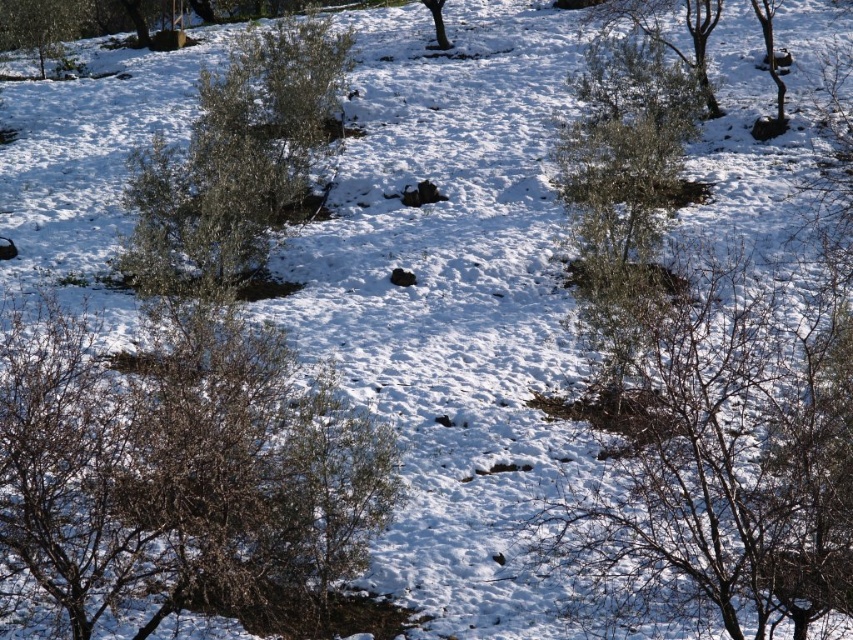
You are standing at the base of the snowy hill and want to walk towards the green leafy shrub at upper right. Which direction should you go from the green leafy shrub at center?

Since the green leafy shrub at center is to the left of the green leafy shrub at upper right, you should go to the right from the green leafy shrub at center to reach the green leafy shrub at upper right.

You are standing at the center of the snowy hillside and want to reach the brown textured bush at lower left. Based on its coordinates, in which general direction should you move from your current position?

The brown textured bush at lower left is located at point (183, 472), which means it is positioned to the lower left direction from your current position at the center. Move towards the lower left direction to reach it.

You are planning to plant a new bush in the snowy landscape. The brown textured bush at lower left and the bare branches at upper right are already present. Which of these two existing plants would require more space if you want to plant a new bush nearby?

The bare branches at upper right requires more space because it is larger in size compared to the brown textured bush at lower left.